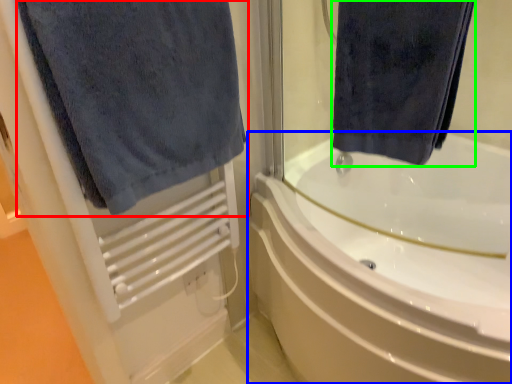
Question: Which object is the closest to the towel (highlighted by a red box)? Choose among these: bathtub (highlighted by a blue box) or towel (highlighted by a green box).

Choices:
 (A) bathtub
 (B) towel

Answer: (B)